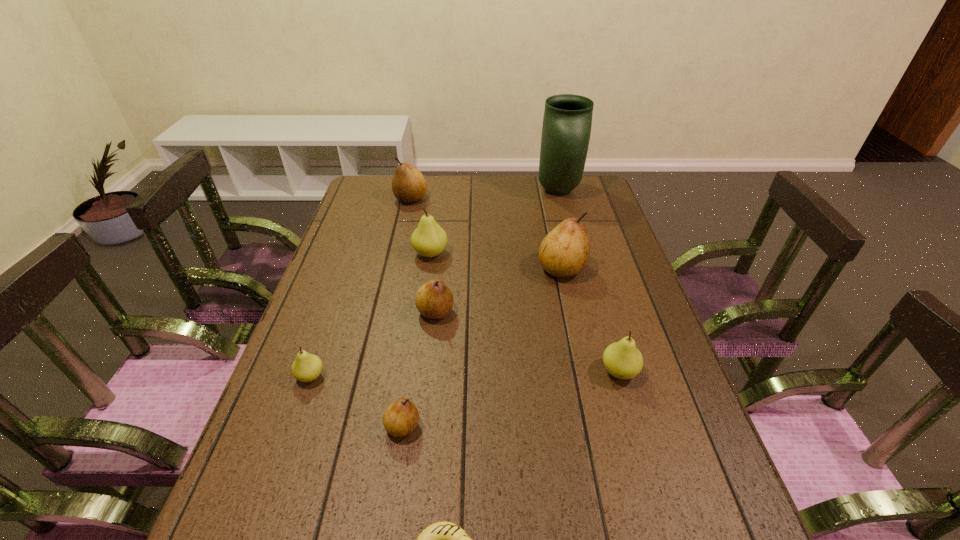
Choose which object is the third nearest neighbor to the nearest object. Please provide its 2D coordinates. Your answer should be formatted as a tuple, i.e. [(x, y)], where the tuple contains the x and y coordinates of a point satisfying the conditions above.

[(622, 359)]

Select which pear is the fourth closest to the nearest brown pear. Please provide its 2D coordinates. Your answer should be formatted as a tuple, i.e. [(x, y)], where the tuple contains the x and y coordinates of a point satisfying the conditions above.

[(429, 240)]

You are a GUI agent. You are given a task and a screenshot of the screen. Output one action in this format:
    pyautogui.click(x=<x>, y=<y>)
    Task: Click on the pear that is the second closest one to the leftmost pear
    This screenshot has height=540, width=960.
    Given the screenshot: What is the action you would take?
    pyautogui.click(x=434, y=300)

Where is `the second closest brown pear relative to the duckling`? the second closest brown pear relative to the duckling is located at coordinates (434, 300).

Identify the location of brown pear that is the third nearest to the nearest pear. Image resolution: width=960 pixels, height=540 pixels. (409, 186).

You are a GUI agent. You are given a task and a screenshot of the screen. Output one action in this format:
    pyautogui.click(x=<x>, y=<y>)
    Task: Click on the second closest green pear to the fourth nearest pear
    The width and height of the screenshot is (960, 540).
    Given the screenshot: What is the action you would take?
    pyautogui.click(x=307, y=367)

Identify which green pear is the closest to the third nearest brown pear. Please provide its 2D coordinates. Your answer should be formatted as a tuple, i.e. [(x, y)], where the tuple contains the x and y coordinates of a point satisfying the conditions above.

[(622, 359)]

Where is `vacant space that satisfies the following two spatial constraints: 1. on the front side of the nearest pear; 2. on the left side of the farthest brown pear`? Image resolution: width=960 pixels, height=540 pixels. vacant space that satisfies the following two spatial constraints: 1. on the front side of the nearest pear; 2. on the left side of the farthest brown pear is located at coordinates (359, 426).

I want to click on blank space that satisfies the following two spatial constraints: 1. on the front side of the smallest brown pear; 2. on the right side of the farthest brown pear, so click(359, 426).

Find the location of a particular element. free spot that satisfies the following two spatial constraints: 1. on the back side of the farthest green pear; 2. on the left side of the smallest green pear is located at coordinates (353, 254).